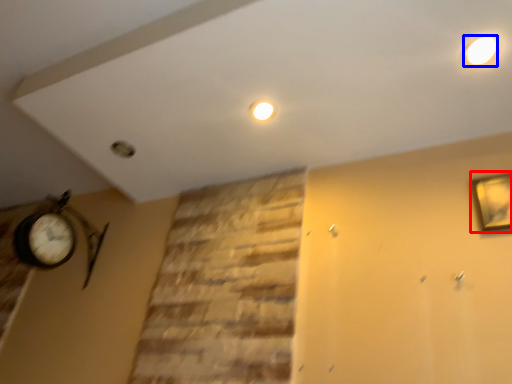
Question: Which object is closer to the camera taking this photo, picture frame (highlighted by a red box) or lighting (highlighted by a blue box)?

Choices:
 (A) picture frame
 (B) lighting

Answer: (B)